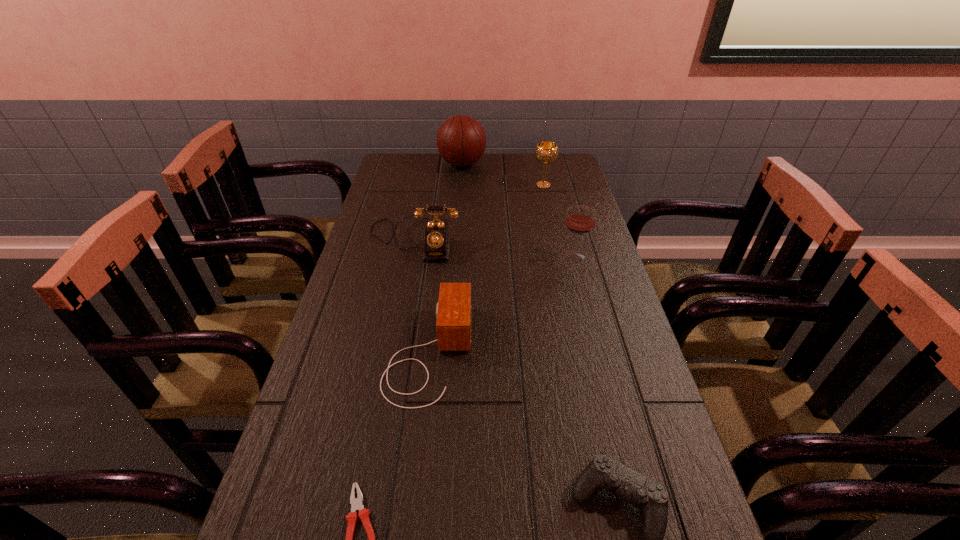
Image resolution: width=960 pixels, height=540 pixels. What are the coordinates of `the tallest object` in the screenshot? It's located at (461, 141).

Image resolution: width=960 pixels, height=540 pixels. Identify the location of basketball. (461, 141).

Image resolution: width=960 pixels, height=540 pixels. I want to click on chalice, so click(546, 152).

Where is `wineglass`? wineglass is located at coordinates (580, 220).

This screenshot has width=960, height=540. What are the coordinates of `telephone` in the screenshot? It's located at (436, 238).

The width and height of the screenshot is (960, 540). I want to click on radio receiver, so click(453, 311).

The width and height of the screenshot is (960, 540). Identify the location of the third shortest object. (453, 311).

Locate an element on the screen. vacant area located on the front of the tallest object is located at coordinates (459, 213).

At what (x,y) coordinates should I click in order to perform the action: click on vacant point located on the front of the sixth nearest object. Please return your answer as a coordinate pair (x, y). The width and height of the screenshot is (960, 540). Looking at the image, I should click on (556, 242).

In order to click on free spot located 0.280m on the front of the wineglass in this screenshot , I will do `click(596, 339)`.